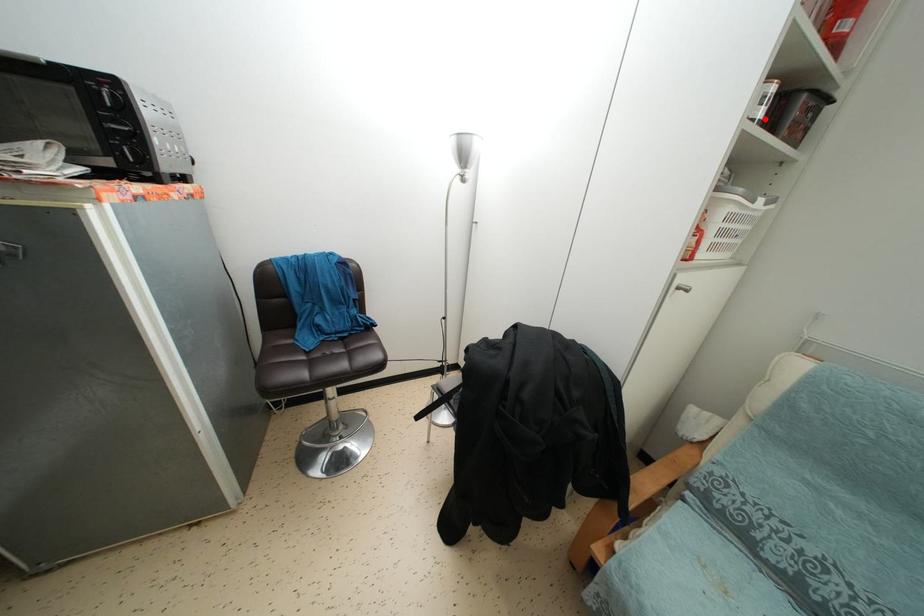
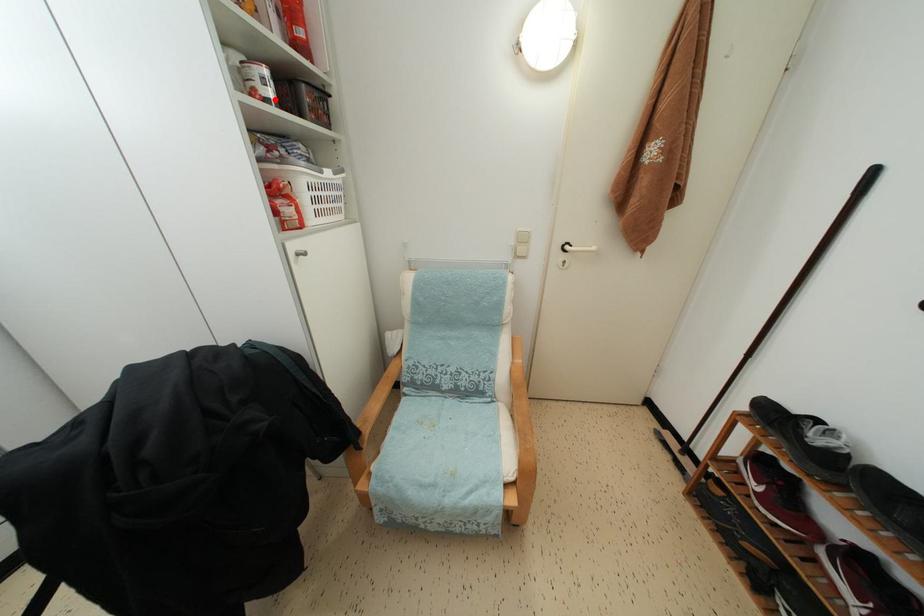
I am providing you with two images of the same scene from different viewpoints. A red point is marked on the first image and another point is marked on the second image. Are the points marked in image1 and image2 representing the same 3D position?

Yes